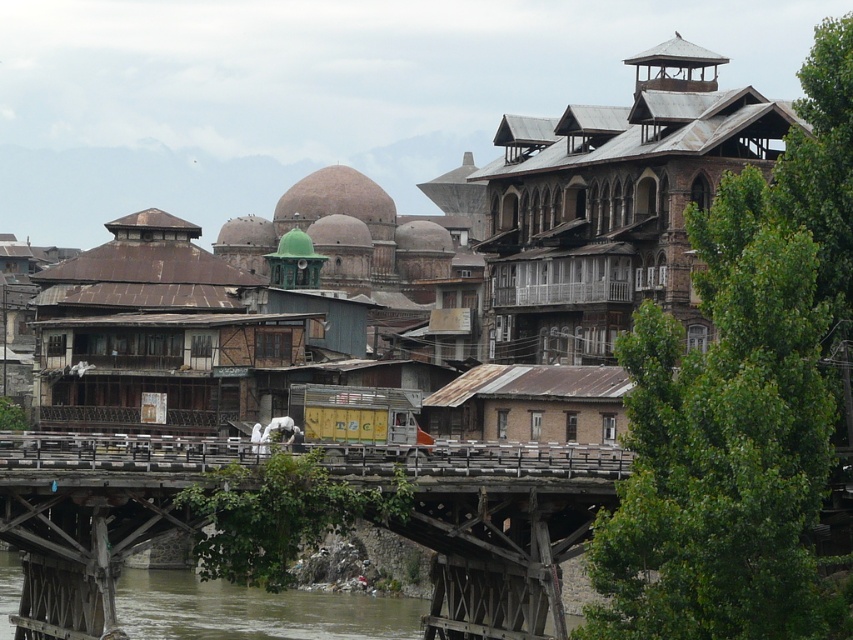
Question: From the image, what is the correct spatial relationship of rustic wooden bridge at center in relation to brown muddy water at lower left?

Choices:
 (A) left
 (B) right

Answer: (B)

Question: Which object is the farthest from the wooden bridge at center?

Choices:
 (A) brown wooden building at upper right
 (B) brown muddy water at lower left
 (C) rustic wooden bridge at center

Answer: (C)

Question: Which of the following is the farthest from the observer?

Choices:
 (A) rustic wooden bridge at center
 (B) brown wooden building at upper right
 (C) rusty wood balcony at left

Answer: (C)

Question: Does rustic wooden bridge at center have a smaller size compared to rusty wood balcony at left?

Choices:
 (A) yes
 (B) no

Answer: (B)

Question: Which point is farther to the camera?

Choices:
 (A) brown wooden building at upper right
 (B) rusty wood balcony at left
 (C) rustic wooden bridge at center

Answer: (B)

Question: Is wooden bridge at center to the right of brown muddy water at lower left from the viewer's perspective?

Choices:
 (A) no
 (B) yes

Answer: (B)